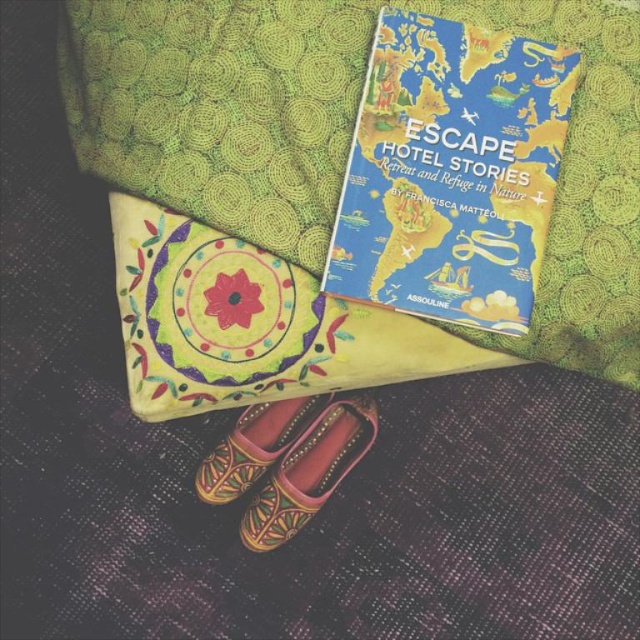
Who is lower down, green textured blanket at upper center or blue matte book at upper center?

green textured blanket at upper center is below.

Can you confirm if green textured blanket at upper center is taller than blue matte book at upper center?

Yes.

Between point (548, 294) and point (570, 88), which one is positioned behind?

The point (548, 294) is behind.

At what (x,y) coordinates should I click in order to perform the action: click on green textured blanket at upper center. Please return your answer as a coordinate pair (x, y). The image size is (640, 640). Looking at the image, I should click on (330, 186).

Between blue matte book at upper center and leather textured shoe at lower center, which one appears on the right side from the viewer's perspective?

blue matte book at upper center

Does blue matte book at upper center have a lesser height compared to leather textured shoe at lower center?

No, blue matte book at upper center is not shorter than leather textured shoe at lower center.

Who is more forward, (371, 70) or (259, 468)?

Positioned in front is point (371, 70).

Image resolution: width=640 pixels, height=640 pixels. I want to click on blue matte book at upper center, so click(451, 172).

Who is positioned more to the right, blue matte book at upper center or leather embroidered shoe at lower center?

blue matte book at upper center

Is blue matte book at upper center positioned behind leather embroidered shoe at lower center?

No, blue matte book at upper center is closer to the viewer.

The height and width of the screenshot is (640, 640). I want to click on blue matte book at upper center, so click(451, 172).